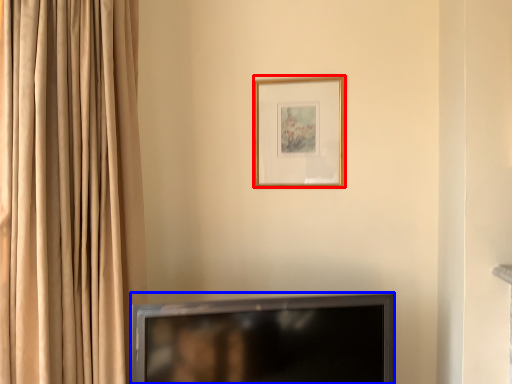
Question: Among these objects, which one is nearest to the camera, picture frame (highlighted by a red box) or television (highlighted by a blue box)?

Choices:
 (A) picture frame
 (B) television

Answer: (B)